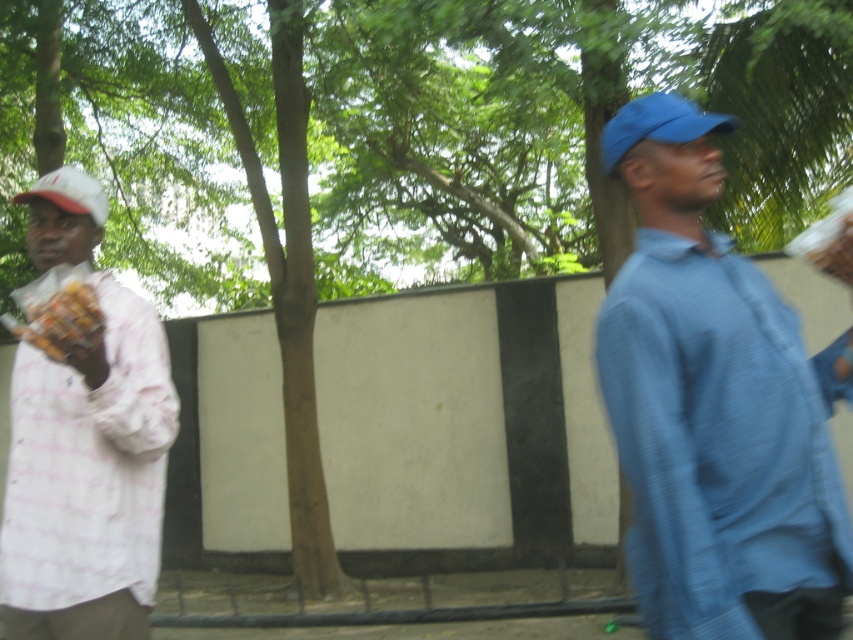
You are standing at the origin of a coordinate system placed at the bottom left corner of the image. The point at (86, 477) is marked. What object is located at that coordinate?

The point at (86, 477) indicates the white checkered shirt at left.

You are a photographer trying to capture a photo of both the blue fabric shirt at right and the white checkered shirt at left. Since you want both subjects to be in the frame, which direction should you move your camera to ensure both are visible?

The blue fabric shirt at right is to the right of the white checkered shirt at left. To include both in the frame, you should move your camera to the left so that both the blue fabric shirt at right and the white checkered shirt at left are within the camera view.